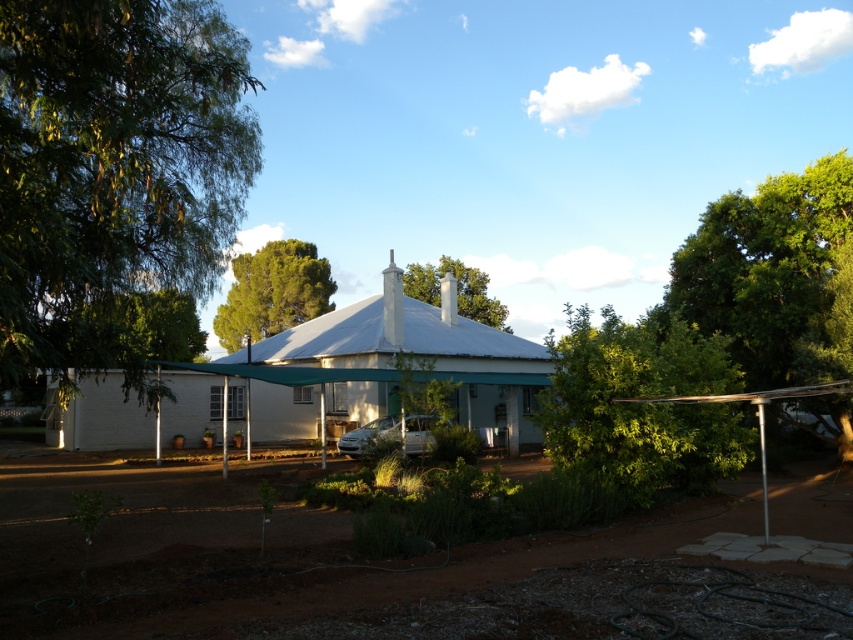
You are standing in the suburban scene and want to set up a picnic. There is a white fabric tent at center. Can you place a picnic blanket at point (328, 378) on the tent? Explain why or why not based on the scene description.

Yes, the point (328, 378) is on the white fabric tent at center, so placing a picnic blanket there would be possible as it is part of the tent structure.

You are standing in front of the house and notice two points marked in the image. Which point, point (384,316) or point (601,410), is closer to you?

Point (384,316) is closer to you because it is further to the viewer than point (601,410).

You are standing in front of the house and notice the green leafy tree at left and the green leafy bush at center. Which one blocks your view of the other?

The green leafy tree at left is in front of the green leafy bush at center, so it blocks the view of the green leafy bush at center.